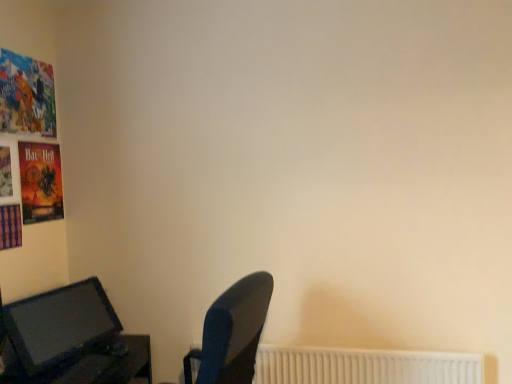
I want to click on matte black monitor at lower left, so click(59, 325).

The width and height of the screenshot is (512, 384). What do you see at coordinates (59, 325) in the screenshot?
I see `matte black monitor at lower left` at bounding box center [59, 325].

Where is `white plastic radiator at lower right`? white plastic radiator at lower right is located at coordinates (364, 366).

This screenshot has width=512, height=384. Describe the element at coordinates (364, 366) in the screenshot. I see `white plastic radiator at lower right` at that location.

Identify the location of matte black monitor at lower left. The height and width of the screenshot is (384, 512). (59, 325).

Is white plastic radiator at lower right to the right of matte black monitor at lower left from the viewer's perspective?

Yes, white plastic radiator at lower right is to the right of matte black monitor at lower left.

Considering their positions, is white plastic radiator at lower right located in front of or behind matte black monitor at lower left?

Visually, white plastic radiator at lower right is located behind matte black monitor at lower left.

Which point is more forward, (385, 375) or (12, 331)?

The point (12, 331) is closer to the camera.

From the image's perspective, which one is positioned higher, white plastic radiator at lower right or matte black monitor at lower left?

matte black monitor at lower left appears higher in the image.

From a real-world perspective, which is physically above, white plastic radiator at lower right or matte black monitor at lower left?

In real-world perspective, matte black monitor at lower left is above.

Is white plastic radiator at lower right wider or thinner than matte black monitor at lower left?

Clearly, white plastic radiator at lower right has less width compared to matte black monitor at lower left.

Can you confirm if white plastic radiator at lower right is taller than matte black monitor at lower left?

No.

Considering the sizes of objects white plastic radiator at lower right and matte black monitor at lower left in the image provided, who is bigger, white plastic radiator at lower right or matte black monitor at lower left?

With larger size is matte black monitor at lower left.

Is matte black monitor at lower left located within white plastic radiator at lower right?

No, matte black monitor at lower left is not a part of white plastic radiator at lower right.

Are white plastic radiator at lower right and matte black monitor at lower left located far from each other?

white plastic radiator at lower right is far away from matte black monitor at lower left.

Is white plastic radiator at lower right aimed at matte black monitor at lower left?

No, white plastic radiator at lower right is not oriented towards matte black monitor at lower left.

Can you tell me how much white plastic radiator at lower right and matte black monitor at lower left differ in facing direction?

The facing directions of white plastic radiator at lower right and matte black monitor at lower left are 78.7 degrees apart.

The width and height of the screenshot is (512, 384). What are the coordinates of `computer monitor above the white plastic radiator at lower right (from a real-world perspective)` in the screenshot? It's located at (59, 325).

Between matte black monitor at lower left and white plastic radiator at lower right, which one appears on the right side from the viewer's perspective?

white plastic radiator at lower right is more to the right.

Considering the relative positions of matte black monitor at lower left and white plastic radiator at lower right in the image provided, is matte black monitor at lower left in front of white plastic radiator at lower right?

Yes, matte black monitor at lower left is closer to the viewer.

Which is more distant, (51, 321) or (288, 373)?

Point (288, 373)

From the image's perspective, which one is positioned higher, matte black monitor at lower left or white plastic radiator at lower right?

From the image's view, matte black monitor at lower left is above.

From a real-world perspective, is matte black monitor at lower left above or below white plastic radiator at lower right?

matte black monitor at lower left is situated higher than white plastic radiator at lower right in the real world.

Can you confirm if matte black monitor at lower left is thinner than white plastic radiator at lower right?

No, matte black monitor at lower left is not thinner than white plastic radiator at lower right.

Considering the relative sizes of matte black monitor at lower left and white plastic radiator at lower right in the image provided, is matte black monitor at lower left taller than white plastic radiator at lower right?

Yes.

Which of these two, matte black monitor at lower left or white plastic radiator at lower right, is smaller?

Smaller between the two is white plastic radiator at lower right.

Is matte black monitor at lower left not inside white plastic radiator at lower right?

Yes, matte black monitor at lower left is located beyond the bounds of white plastic radiator at lower right.

Is matte black monitor at lower left not close to white plastic radiator at lower right?

Yes, matte black monitor at lower left and white plastic radiator at lower right are located far from each other.

Is matte black monitor at lower left oriented away from white plastic radiator at lower right?

No, white plastic radiator at lower right is not at the back of matte black monitor at lower left.

Identify the location of computer monitor on the left of white plastic radiator at lower right. (59, 325).

The width and height of the screenshot is (512, 384). Find the location of `radiator below the matte black monitor at lower left (from the image's perspective)`. radiator below the matte black monitor at lower left (from the image's perspective) is located at coordinates (364, 366).

This screenshot has width=512, height=384. What are the coordinates of `computer monitor above the white plastic radiator at lower right (from the image's perspective)` in the screenshot? It's located at (59, 325).